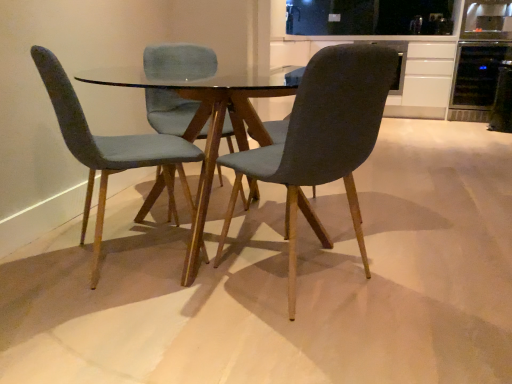
Question: Does dark gray fabric chair at center, acting as the 1th chair starting from the right, touch white matte cabinet at upper right?

Choices:
 (A) no
 (B) yes

Answer: (A)

Question: Considering the relative sizes of dark gray fabric chair at center, which is counted as the second chair, starting from the left, and white matte cabinet at upper right in the image provided, is dark gray fabric chair at center, which is counted as the second chair, starting from the left, bigger than white matte cabinet at upper right?

Choices:
 (A) no
 (B) yes

Answer: (A)

Question: Is dark gray fabric chair at center, which is counted as the second chair, starting from the left, oriented away from white matte cabinet at upper right?

Choices:
 (A) yes
 (B) no

Answer: (B)

Question: Could white matte cabinet at upper right be considered to be inside dark gray fabric chair at center, acting as the 1th chair starting from the right?

Choices:
 (A) no
 (B) yes

Answer: (A)

Question: Is dark gray fabric chair at center, which is counted as the second chair, starting from the left, facing towards white matte cabinet at upper right?

Choices:
 (A) no
 (B) yes

Answer: (A)

Question: Looking at the image, does white matte cabinet at upper right seem bigger or smaller compared to velvet teal chair at left, the 1th chair in the left-to-right sequence?

Choices:
 (A) big
 (B) small

Answer: (A)

Question: In the image, is white matte cabinet at upper right positioned in front of or behind velvet teal chair at left, arranged as the 2th chair when viewed from the right?

Choices:
 (A) behind
 (B) front

Answer: (A)

Question: Would you say white matte cabinet at upper right is inside or outside velvet teal chair at left, arranged as the 2th chair when viewed from the right?

Choices:
 (A) outside
 (B) inside

Answer: (A)

Question: From the image's perspective, relative to velvet teal chair at left, the 1th chair in the left-to-right sequence, is white matte cabinet at upper right above or below?

Choices:
 (A) below
 (B) above

Answer: (B)

Question: Considering their positions, is transparent glass table at center located in front of or behind black glass wine cooler at upper right, the 1th appliance from the back?

Choices:
 (A) front
 (B) behind

Answer: (A)

Question: Is transparent glass table at center situated inside black glass wine cooler at upper right, the 1th appliance from the back, or outside?

Choices:
 (A) outside
 (B) inside

Answer: (A)

Question: From a real-world perspective, is transparent glass table at center above or below black glass wine cooler at upper right, positioned as the 2th appliance in front-to-back order?

Choices:
 (A) above
 (B) below

Answer: (B)

Question: Considering the positions of transparent glass table at center and black glass wine cooler at upper right, positioned as the 2th appliance in front-to-back order, in the image, is transparent glass table at center wider or thinner than black glass wine cooler at upper right, positioned as the 2th appliance in front-to-back order,?

Choices:
 (A) thin
 (B) wide

Answer: (B)

Question: From the image's perspective, is dark gray fabric chair at center, acting as the 1th chair starting from the right, located above or below black glass wine cooler at upper right, positioned as the 2th appliance in front-to-back order?

Choices:
 (A) above
 (B) below

Answer: (B)

Question: In the image, is dark gray fabric chair at center, which is counted as the second chair, starting from the left, positioned in front of or behind black glass wine cooler at upper right, the 1th appliance from the back?

Choices:
 (A) front
 (B) behind

Answer: (A)